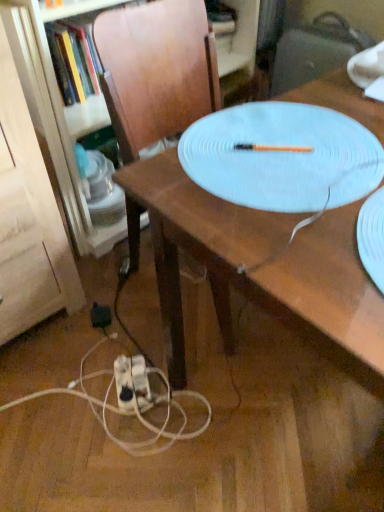
Identify the location of vacant position to the left of black plastic electric outlet at lower left. (57, 334).